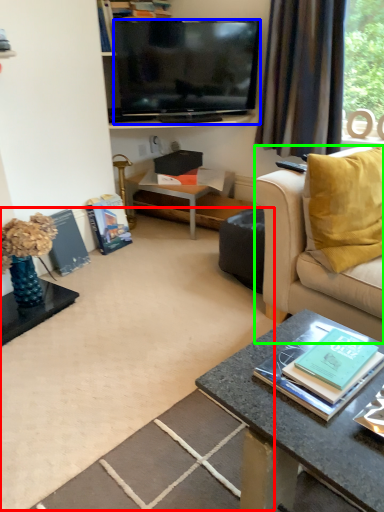
Question: Considering the real-world distances, which object is farthest from plain (highlighted by a red box)? television (highlighted by a blue box) or studio couch (highlighted by a green box)?

Choices:
 (A) television
 (B) studio couch

Answer: (A)